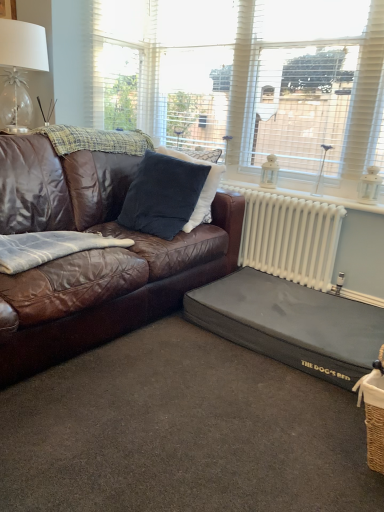
Question: From the image's perspective, is white metallic radiator at right located beneath white textured window at upper center, which is counted as the first window, starting from the left?

Choices:
 (A) no
 (B) yes

Answer: (B)

Question: Is white metallic radiator at right not near white textured window at upper center, which is counted as the first window, starting from the left?

Choices:
 (A) yes
 (B) no

Answer: (B)

Question: Does white metallic radiator at right appear on the right side of white textured window at upper center, which is counted as the first window, starting from the left?

Choices:
 (A) no
 (B) yes

Answer: (B)

Question: Is white metallic radiator at right wider than white textured window at upper center, marked as the 2th window in a right-to-left arrangement?

Choices:
 (A) yes
 (B) no

Answer: (B)

Question: Is white metallic radiator at right closer to camera compared to white textured window at upper center, which is counted as the first window, starting from the left?

Choices:
 (A) no
 (B) yes

Answer: (A)

Question: Is white textured window at upper center, marked as the 2th window in a right-to-left arrangement, at the back of white metallic radiator at right?

Choices:
 (A) yes
 (B) no

Answer: (B)

Question: From the image's perspective, is white metallic radiator at right beneath black fabric dog bed at lower right?

Choices:
 (A) no
 (B) yes

Answer: (A)

Question: Is white metallic radiator at right shorter than black fabric dog bed at lower right?

Choices:
 (A) no
 (B) yes

Answer: (A)

Question: From a real-world perspective, is white metallic radiator at right on black fabric dog bed at lower right?

Choices:
 (A) no
 (B) yes

Answer: (B)

Question: Is white metallic radiator at right further to the viewer compared to black fabric dog bed at lower right?

Choices:
 (A) yes
 (B) no

Answer: (A)

Question: Does white metallic radiator at right lie in front of black fabric dog bed at lower right?

Choices:
 (A) yes
 (B) no

Answer: (B)

Question: Does white metallic radiator at right have a lesser width compared to black fabric dog bed at lower right?

Choices:
 (A) no
 (B) yes

Answer: (B)

Question: Does white textured window at upper center, which is counted as the first window, starting from the left, lie behind black fabric dog bed at lower right?

Choices:
 (A) yes
 (B) no

Answer: (A)